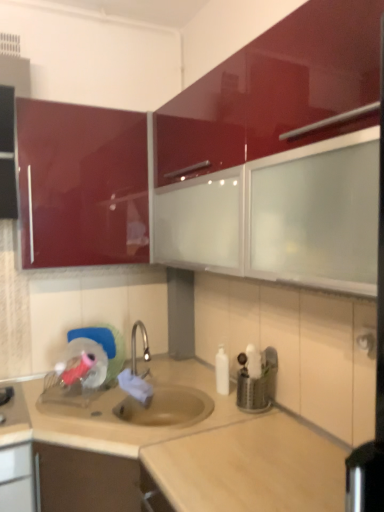
Question: Considering the relative positions of beige laminate countertop at center and glossy red cabinet at upper center, the first cabinetry positioned from the right, in the image provided, is beige laminate countertop at center to the right of glossy red cabinet at upper center, the first cabinetry positioned from the right, from the viewer's perspective?

Choices:
 (A) yes
 (B) no

Answer: (B)

Question: Is beige laminate countertop at center thinner than glossy red cabinet at upper center, which is the second cabinetry from left to right?

Choices:
 (A) no
 (B) yes

Answer: (A)

Question: Is beige laminate countertop at center not inside glossy red cabinet at upper center, which is the second cabinetry from left to right?

Choices:
 (A) yes
 (B) no

Answer: (A)

Question: Is beige laminate countertop at center closer to the viewer compared to glossy red cabinet at upper center, the first cabinetry positioned from the right?

Choices:
 (A) no
 (B) yes

Answer: (B)

Question: Is beige laminate countertop at center directly adjacent to glossy red cabinet at upper center, which is the second cabinetry from left to right?

Choices:
 (A) no
 (B) yes

Answer: (A)

Question: From a real-world perspective, is glossy red cabinet at upper left, which appears as the second cabinetry when viewed from the right, positioned above or below metallic silver utensil holder at center?

Choices:
 (A) below
 (B) above

Answer: (B)

Question: In terms of height, does glossy red cabinet at upper left, marked as the first cabinetry in a left-to-right arrangement, look taller or shorter compared to metallic silver utensil holder at center?

Choices:
 (A) tall
 (B) short

Answer: (A)

Question: From the image's perspective, relative to metallic silver utensil holder at center, is glossy red cabinet at upper left, which appears as the second cabinetry when viewed from the right, above or below?

Choices:
 (A) above
 (B) below

Answer: (A)

Question: Is glossy red cabinet at upper left, which appears as the second cabinetry when viewed from the right, inside the boundaries of metallic silver utensil holder at center, or outside?

Choices:
 (A) inside
 (B) outside

Answer: (B)

Question: From a real-world perspective, is glossy red cabinet at upper center, the first cabinetry positioned from the right, physically located above or below beige laminate countertop at center?

Choices:
 (A) above
 (B) below

Answer: (A)

Question: In terms of width, does glossy red cabinet at upper center, the first cabinetry positioned from the right, look wider or thinner when compared to beige laminate countertop at center?

Choices:
 (A) wide
 (B) thin

Answer: (B)

Question: Is glossy red cabinet at upper center, which is the second cabinetry from left to right, bigger or smaller than beige laminate countertop at center?

Choices:
 (A) big
 (B) small

Answer: (B)

Question: Is point (268, 131) positioned closer to the camera than point (99, 436)?

Choices:
 (A) farther
 (B) closer

Answer: (B)

Question: Which is correct: metallic silver utensil holder at center is inside beige laminate countertop at center, or outside of it?

Choices:
 (A) outside
 (B) inside

Answer: (A)

Question: From a real-world perspective, is metallic silver utensil holder at center physically located above or below beige laminate countertop at center?

Choices:
 (A) above
 (B) below

Answer: (A)